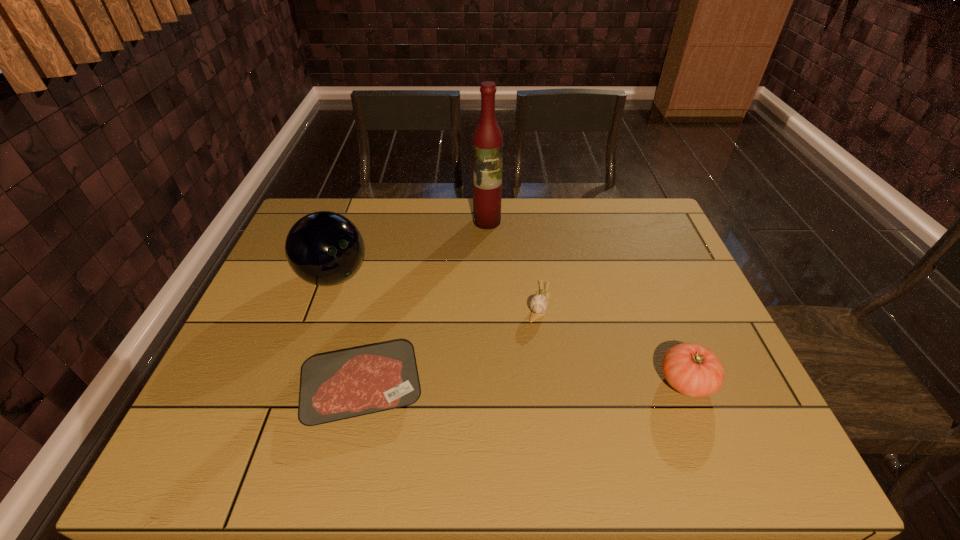
Locate an element on the screen. The width and height of the screenshot is (960, 540). vacant space on the desktop that is between the shortest object and the rightmost object and is positioned on the shell of the escargot is located at coordinates (520, 385).

The width and height of the screenshot is (960, 540). Identify the location of vacant spot on the desktop that is between the shortest object and the third tallest object and is positioned on the side of the fourth shortest object with the finger holes. (516, 385).

This screenshot has height=540, width=960. In order to click on free space on the desktop that is between the shortest object and the rightmost object and is positioned on the label of the farthest object in this screenshot , I will do `click(483, 386)`.